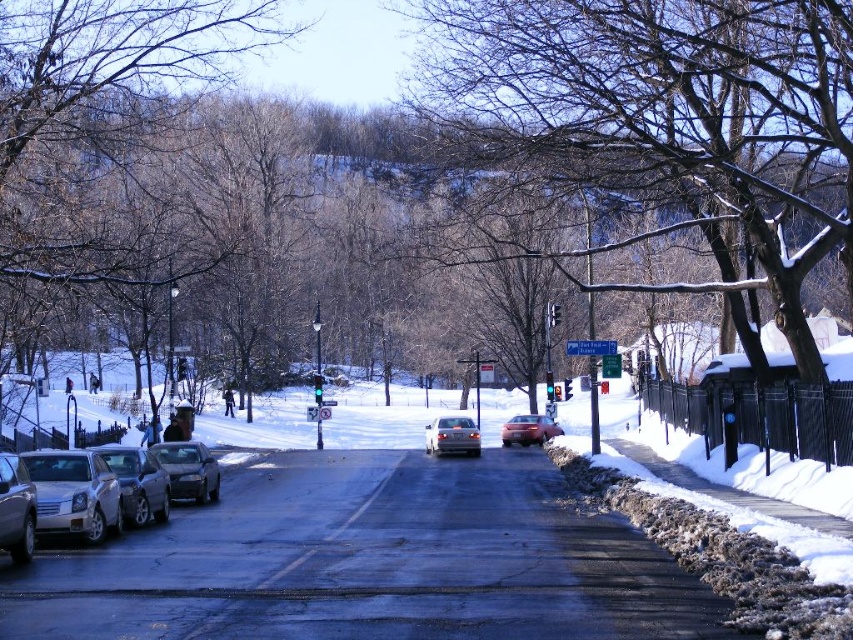
Question: Does silver metallic sedan at left appear over satin silver sedan at center?

Choices:
 (A) yes
 (B) no

Answer: (A)

Question: Which of these objects is positioned closest to the satin silver sedan at center?

Choices:
 (A) snow-covered branches at upper center
 (B) metallic gray sedan at left
 (C) snow-covered branches at center
 (D) shiny silver sedan at center

Answer: (D)

Question: Observing the image, what is the correct spatial positioning of snow-covered branches at upper center in reference to silver metallic car at left?

Choices:
 (A) above
 (B) below

Answer: (A)

Question: Which of the following is the closest to the observer?

Choices:
 (A) (149, 509)
 (B) (30, 492)

Answer: (B)

Question: Is snow-covered branches at upper center further to camera compared to metallic gray sedan at left?

Choices:
 (A) yes
 (B) no

Answer: (B)

Question: Which of the following is the farthest from the observer?

Choices:
 (A) pos(19,544)
 (B) pos(138,481)
 (C) pos(51,200)
 (D) pos(525,445)

Answer: (D)